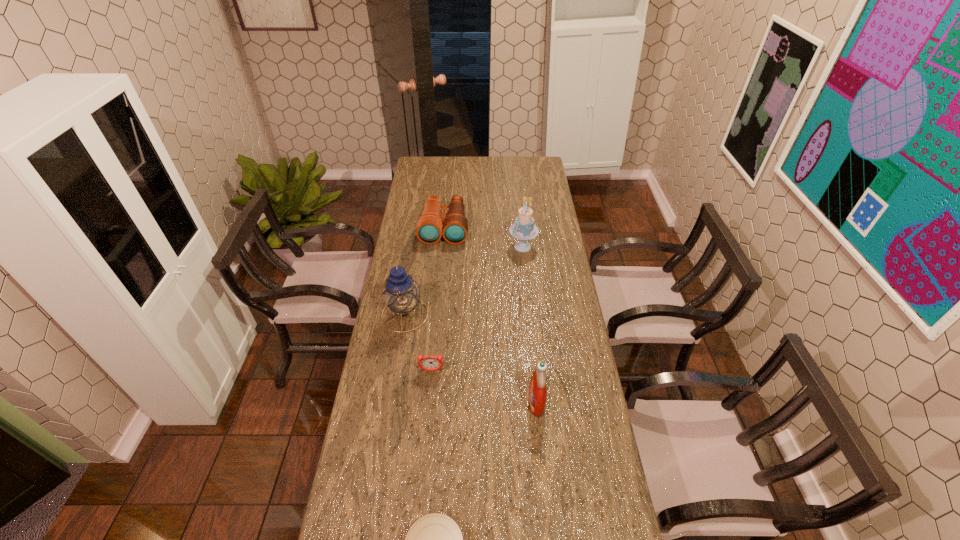
Locate an element on the screen. free location at the right edge of the desktop is located at coordinates (609, 477).

At what (x,y) coordinates should I click in order to perform the action: click on blank space at the far right corner of the desktop. Please return your answer as a coordinate pair (x, y). The height and width of the screenshot is (540, 960). Looking at the image, I should click on (545, 174).

I want to click on empty location between the third farthest object and the detergent, so click(470, 358).

Where is `vacant point located between the fourth farthest object and the lantern`? The height and width of the screenshot is (540, 960). vacant point located between the fourth farthest object and the lantern is located at coordinates (419, 343).

The width and height of the screenshot is (960, 540). I want to click on unoccupied area between the fifth farthest object and the fourth tallest object, so click(491, 314).

Find the location of a particular element. The height and width of the screenshot is (540, 960). unoccupied position between the binoculars and the alarm clock is located at coordinates pyautogui.click(x=438, y=299).

Find the location of a particular element. This screenshot has width=960, height=540. object that is the closest to the third nearest object is located at coordinates (401, 293).

Point out which object is positioned as the second nearest to the third shortest object. Please provide its 2D coordinates. Your answer should be formatted as a tuple, i.e. [(x, y)], where the tuple contains the x and y coordinates of a point satisfying the conditions above.

[(401, 293)]